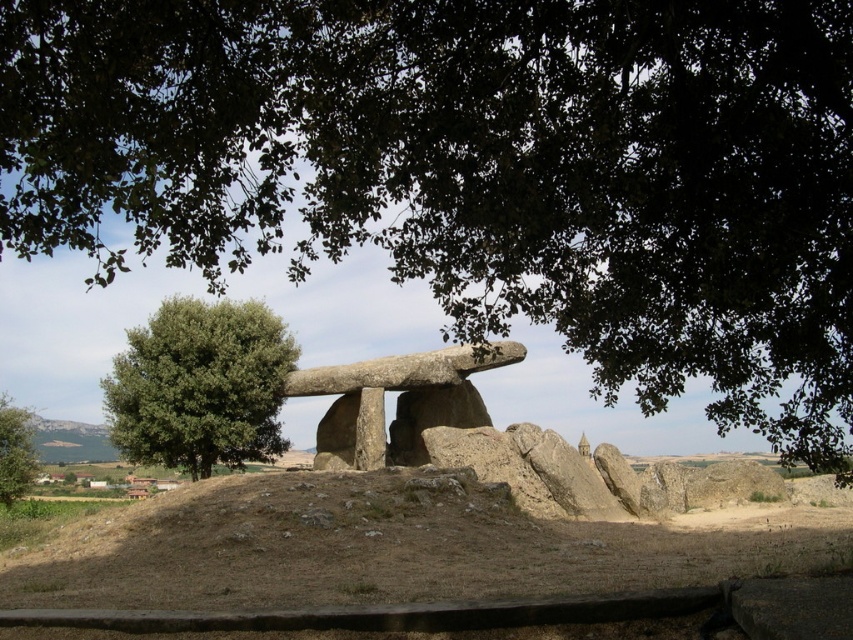
You are standing in front of the ancient dolmen and want to take a photo. There are two points marked in the image, point 1 at coordinates (503,516) and point 2 at (170,337). Which point should you focus on to ensure the dolmen is in sharp focus?

Point 1 at coordinates (503,516) is closer to the camera, so focusing on this point will ensure the dolmen is in sharp focus.